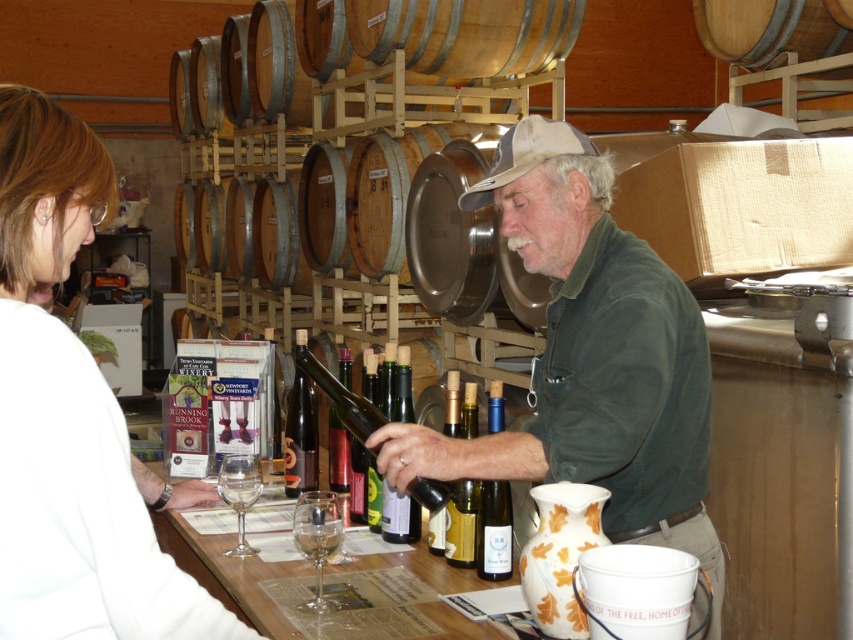
Question: Considering the relative positions of green matte shirt at center and green matte bottle at center in the image provided, where is green matte shirt at center located with respect to green matte bottle at center?

Choices:
 (A) above
 (B) below

Answer: (A)

Question: Is green matte bottle at center closer to camera compared to clear glass at lower center?

Choices:
 (A) no
 (B) yes

Answer: (A)

Question: Among these objects, which one is nearest to the camera?

Choices:
 (A) wooden barrel at upper right
 (B) translucent glass wine bottle at center
 (C) matte white shirt at center

Answer: (C)

Question: Can you confirm if translucent amber glass bottle at center is positioned to the left of green matte bottle at center?

Choices:
 (A) yes
 (B) no

Answer: (A)

Question: Which point is closer to the camera?

Choices:
 (A) clear glass at lower center
 (B) shiny dark glass bottle at center
 (C) green matte shirt at center

Answer: (C)

Question: Which object is closer to the camera taking this photo?

Choices:
 (A) translucent glass wine bottle at center
 (B) clear glass wine glass at center
 (C) green matte bottle at center

Answer: (B)